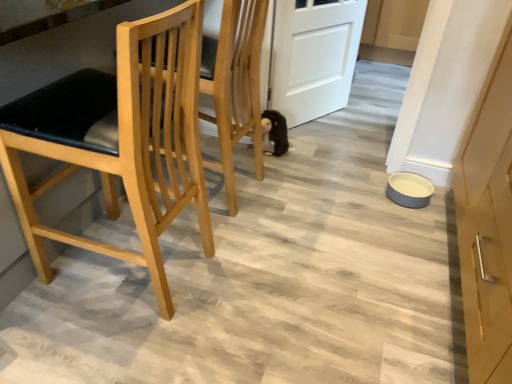
Question: From the image's perspective, is white matte door at center beneath natural wood chair at left?

Choices:
 (A) yes
 (B) no

Answer: (B)

Question: Is white matte door at center wider than natural wood chair at left?

Choices:
 (A) no
 (B) yes

Answer: (A)

Question: Is white matte door at center oriented away from natural wood chair at left?

Choices:
 (A) yes
 (B) no

Answer: (B)

Question: Is white matte door at center positioned beyond the bounds of natural wood chair at left?

Choices:
 (A) no
 (B) yes

Answer: (B)

Question: Is white matte door at center to the left of natural wood chair at left from the viewer's perspective?

Choices:
 (A) yes
 (B) no

Answer: (B)

Question: In the image, is white matte door at center on the left side or the right side of natural wood chair at left?

Choices:
 (A) right
 (B) left

Answer: (A)

Question: From the image's perspective, relative to natural wood chair at left, is white matte door at center above or below?

Choices:
 (A) above
 (B) below

Answer: (A)

Question: Is white matte door at center wider or thinner than natural wood chair at left?

Choices:
 (A) wide
 (B) thin

Answer: (B)

Question: Which is correct: white matte door at center is inside natural wood chair at left, or outside of it?

Choices:
 (A) inside
 (B) outside

Answer: (B)

Question: Is black plush toy at center spatially inside white matte door at center, or outside of it?

Choices:
 (A) inside
 (B) outside

Answer: (B)

Question: Does point (283, 122) appear closer or farther from the camera than point (331, 100)?

Choices:
 (A) closer
 (B) farther

Answer: (A)

Question: Considering their positions, is black plush toy at center located in front of or behind white matte door at center?

Choices:
 (A) front
 (B) behind

Answer: (B)

Question: From a real-world perspective, relative to white matte door at center, is black plush toy at center vertically above or below?

Choices:
 (A) below
 (B) above

Answer: (A)

Question: In the image, is natural wood chair at left on the left side or the right side of black plush toy at center?

Choices:
 (A) left
 (B) right

Answer: (A)

Question: In terms of height, does natural wood chair at left look taller or shorter compared to black plush toy at center?

Choices:
 (A) short
 (B) tall

Answer: (B)